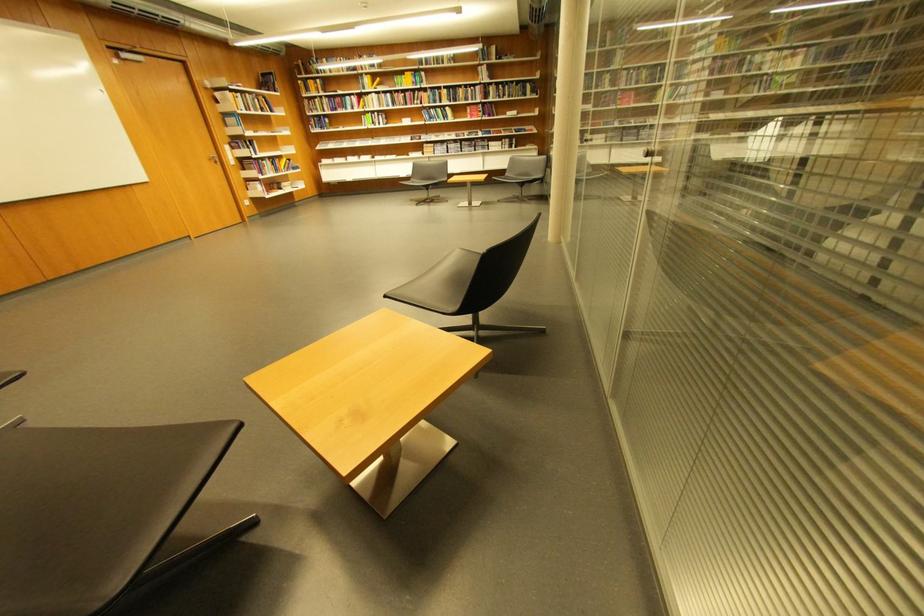
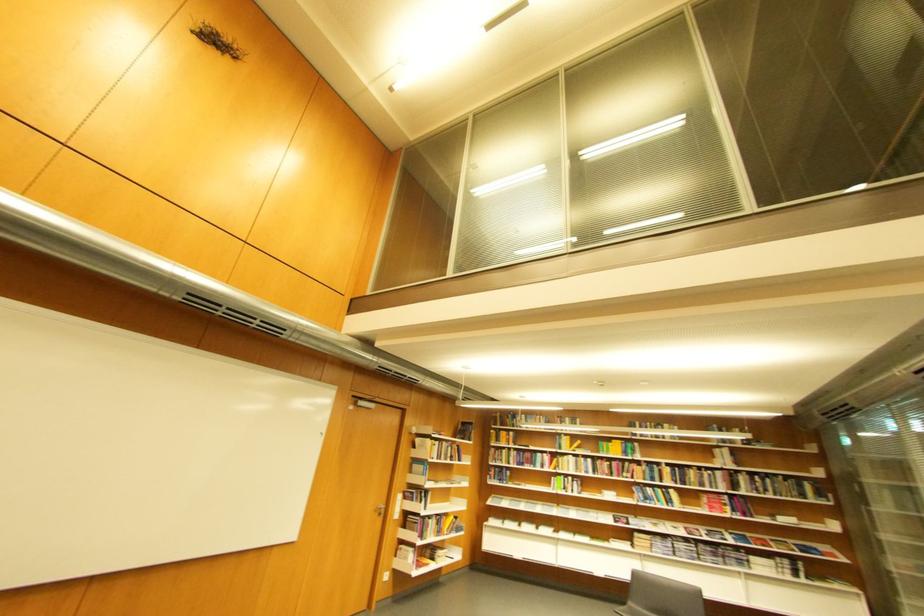
Locate, in the second image, the point that corresponds to point 454,150 in the first image.

(677, 549)